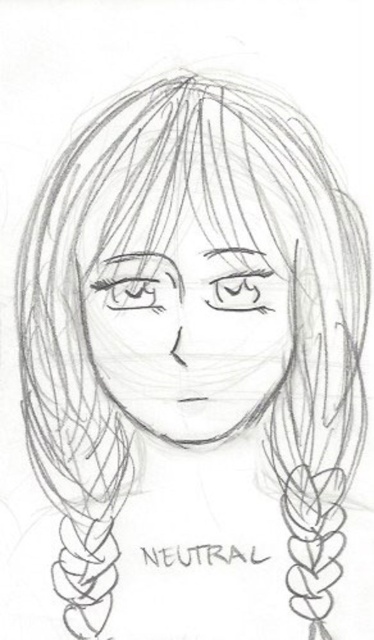
From the picture: Is pencil sketch face at center to the left of matte pencil eye at upper center from the viewer's perspective?

Indeed, pencil sketch face at center is positioned on the left side of matte pencil eye at upper center.

Who is higher up, pencil sketch face at center or matte pencil eye at upper center?

Positioned higher is matte pencil eye at upper center.

Locate an element on the screen. pencil sketch face at center is located at coordinates (188, 332).

This screenshot has width=374, height=640. What do you see at coordinates (238, 291) in the screenshot?
I see `matte pencil eye at upper center` at bounding box center [238, 291].

Is matte pencil eye at upper center to the left of pencil sketch eye at center from the viewer's perspective?

Incorrect, matte pencil eye at upper center is not on the left side of pencil sketch eye at center.

Locate an element on the screen. The width and height of the screenshot is (374, 640). matte pencil eye at upper center is located at coordinates (238, 291).

Between pencil sketch face at center and pencil sketch eye at center, which one appears on the left side from the viewer's perspective?

pencil sketch eye at center

Can you confirm if pencil sketch face at center is positioned to the left of pencil sketch eye at center?

No, pencil sketch face at center is not to the left of pencil sketch eye at center.

Who is more distant from viewer, (x=237, y=298) or (x=100, y=282)?

Point (x=237, y=298)

Identify the location of pencil sketch face at center. (188, 332).